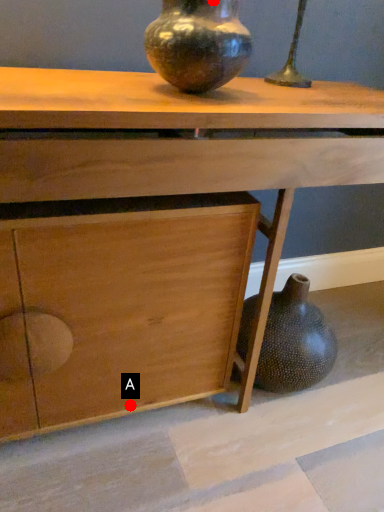
Question: Two points are circled on the image, labeled by A and B beside each circle. Which of the following is the closest to the observer?

Choices:
 (A) A is closer
 (B) B is closer

Answer: (B)